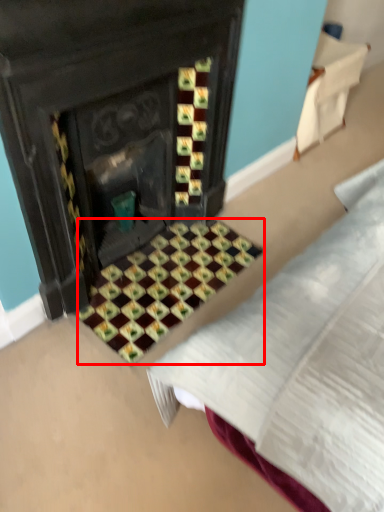
Question: From the image's perspective, where is pattern (annotated by the red box) located in relation to furniture in the image?

Choices:
 (A) above
 (B) below

Answer: (B)